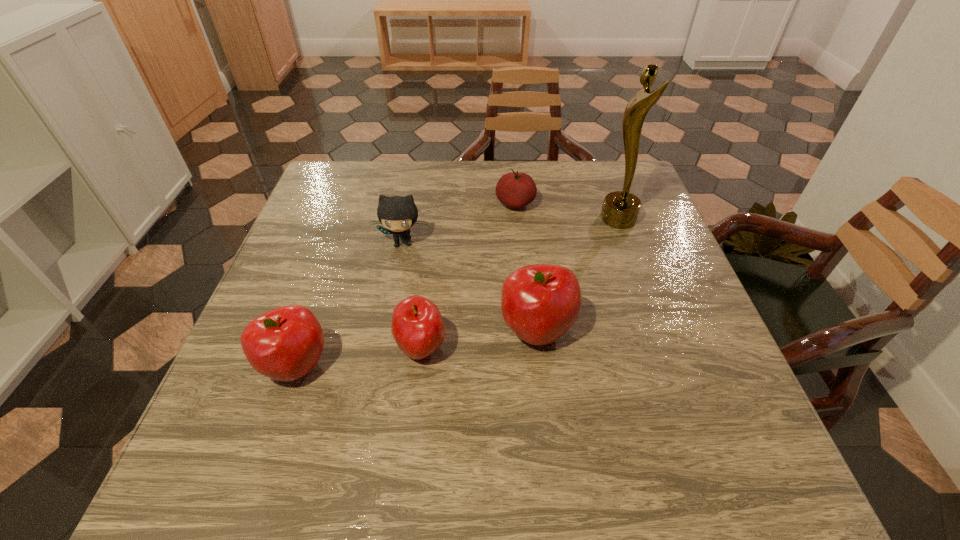
Identify the location of the second tallest apple. click(x=285, y=344).

At what (x,y) coordinates should I click in order to perform the action: click on the leftmost object. Please return your answer as a coordinate pair (x, y). This screenshot has height=540, width=960. Looking at the image, I should click on (285, 344).

Find the location of a particular element. This screenshot has height=540, width=960. the shortest apple is located at coordinates (417, 327).

Where is `the rightmost apple`? Image resolution: width=960 pixels, height=540 pixels. the rightmost apple is located at coordinates click(539, 303).

Where is `award`? award is located at coordinates (620, 209).

This screenshot has width=960, height=540. Identify the location of the tallest object. (620, 209).

This screenshot has height=540, width=960. I want to click on the shortest object, so click(x=515, y=189).

Identify the location of kitten. (397, 214).

Where is `vacant space positioned on the right of the second tallest apple`? The width and height of the screenshot is (960, 540). vacant space positioned on the right of the second tallest apple is located at coordinates (450, 366).

Where is `free space located on the back of the shortest apple`? Image resolution: width=960 pixels, height=540 pixels. free space located on the back of the shortest apple is located at coordinates (435, 227).